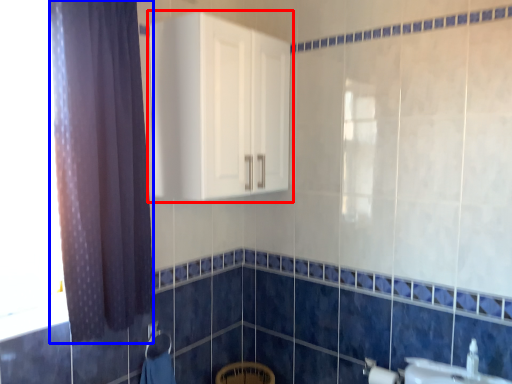
Question: Which of the following is the farthest to the observer, cabinetry (highlighted by a red box) or curtain (highlighted by a blue box)?

Choices:
 (A) cabinetry
 (B) curtain

Answer: (A)